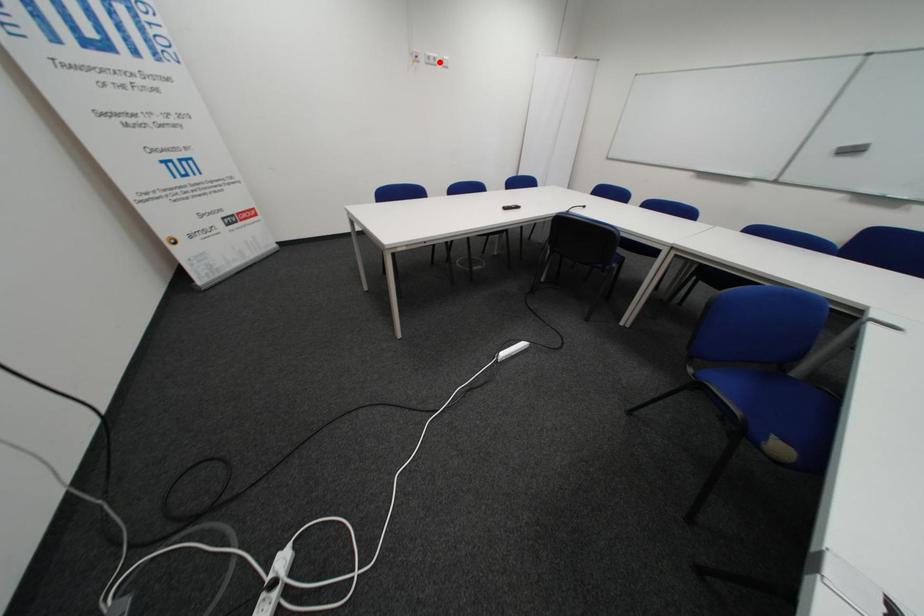
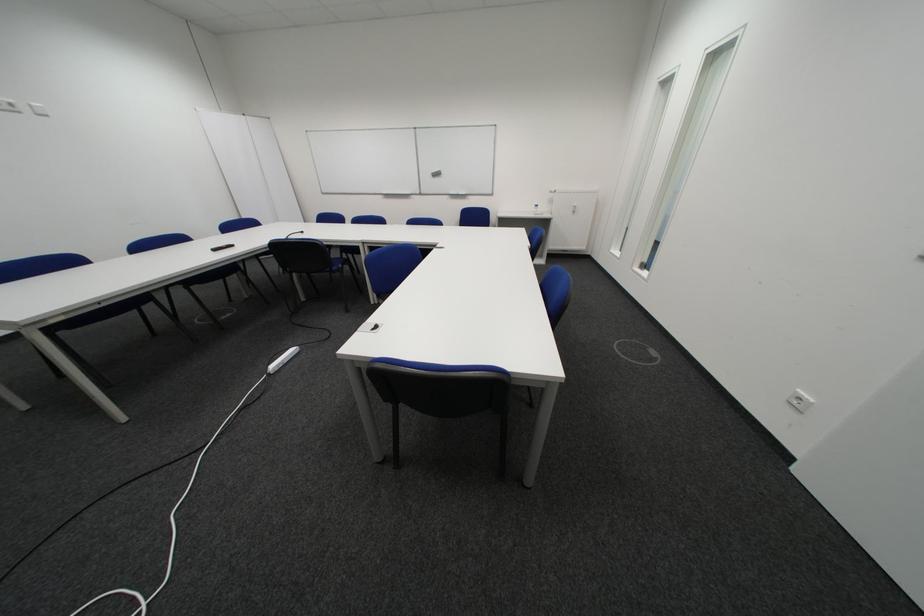
Question: I am providing you with two images of the same scene from different viewpoints. In image1, a red point is highlighted. Considering the same 3D point in image2, which of the following is correct?

Choices:
 (A) It is closer
 (B) It is farther

Answer: (B)